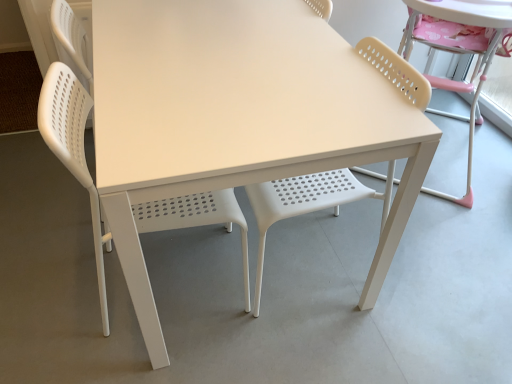
Where is `vacant area located to the right-hand side of matte white chair at center, which ranks as the 2th chair in left-to-right order`? vacant area located to the right-hand side of matte white chair at center, which ranks as the 2th chair in left-to-right order is located at coordinates (417, 275).